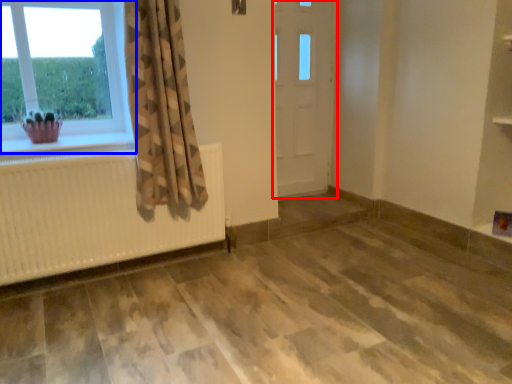
Question: Which object is closer to the camera taking this photo, door (highlighted by a red box) or window (highlighted by a blue box)?

Choices:
 (A) door
 (B) window

Answer: (B)